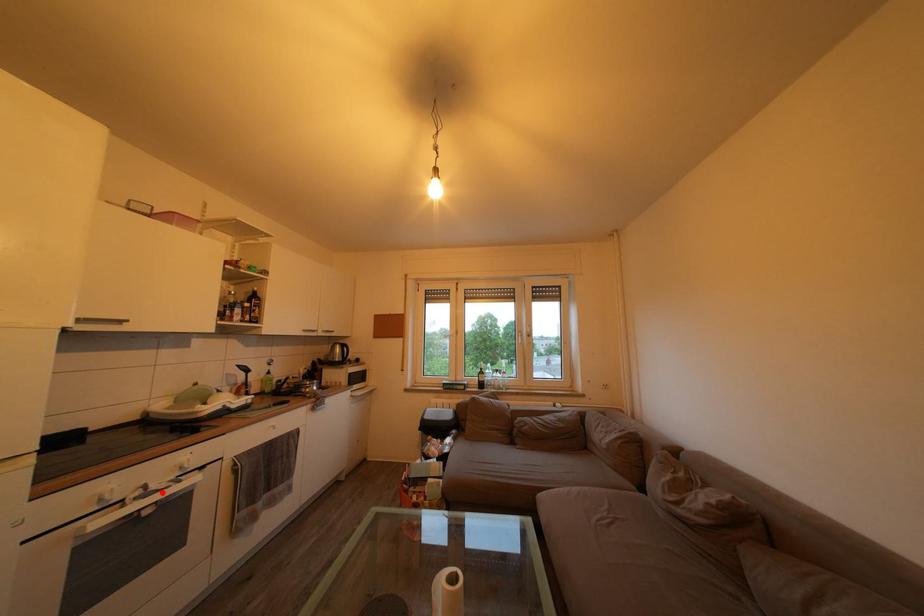
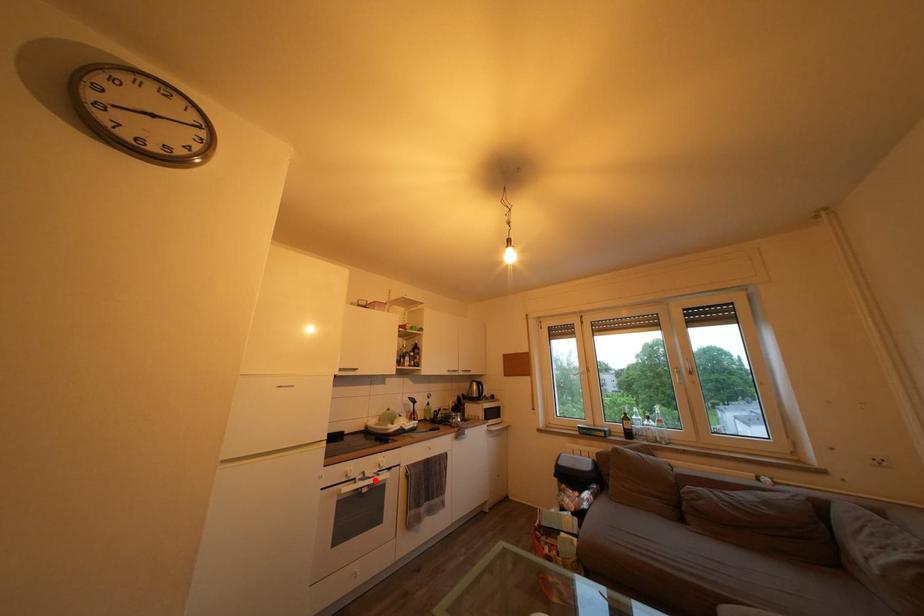
I am providing you with two images of the same scene from different viewpoints. A red point is marked on the first image and another point is marked on the second image. Does the point marked in image1 correspond to the same location as the one in image2?

Yes